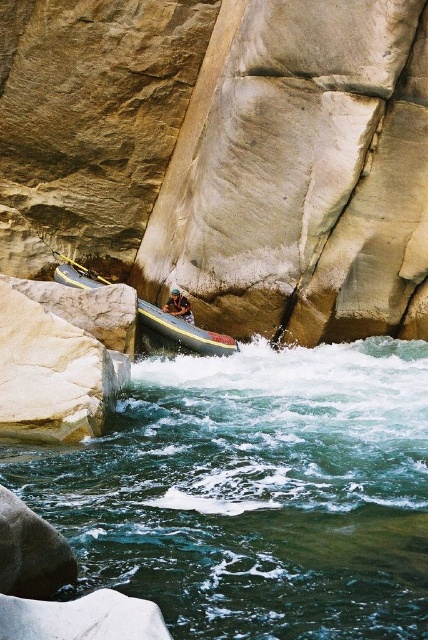
Question: Is brown leather helmet at center further to camera compared to yellow plastic paddle at center?

Choices:
 (A) no
 (B) yes

Answer: (A)

Question: Which object is closer to the camera taking this photo?

Choices:
 (A) yellow plastic paddle at center
 (B) rubber boat at center

Answer: (B)

Question: Can you confirm if clear blue water at center is positioned to the right of rubber boat at center?

Choices:
 (A) yes
 (B) no

Answer: (A)

Question: Which point is closer to the camera taking this photo?

Choices:
 (A) (172, 298)
 (B) (183, 547)
 (C) (98, 364)
 (D) (71, 259)

Answer: (B)

Question: Which object appears farthest from the camera in this image?

Choices:
 (A) rubber boat at center
 (B) yellow plastic paddle at center

Answer: (B)

Question: Is white smooth rock at center bigger than brown leather helmet at center?

Choices:
 (A) no
 (B) yes

Answer: (A)